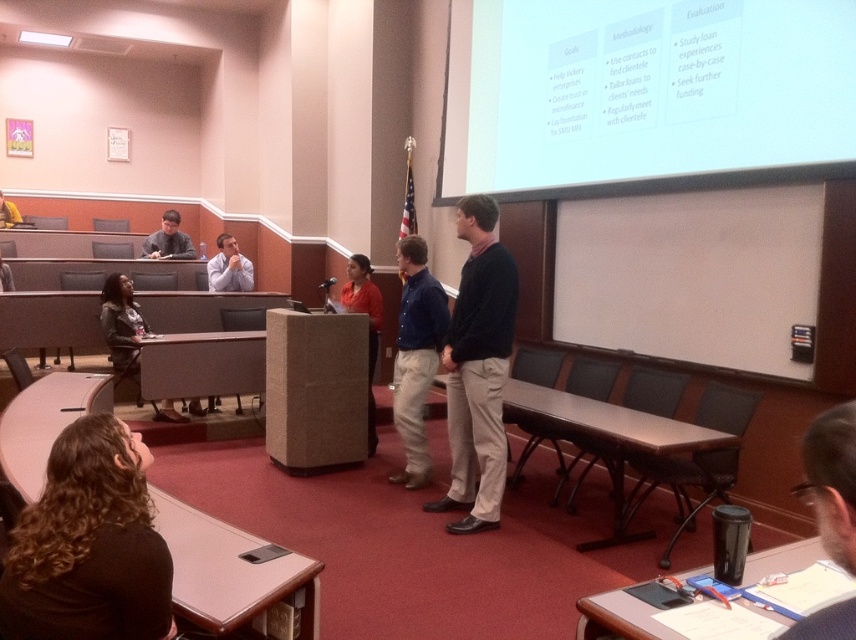
Question: Which of the following is the closest to the observer?

Choices:
 (A) (123, 339)
 (B) (819, 634)

Answer: (B)

Question: Can you confirm if white matte projection screen at upper center is positioned above blue denim shirt at center?

Choices:
 (A) yes
 (B) no

Answer: (A)

Question: Estimate the real-world distances between objects in this image. Which object is farther from the dark brown hair at lower right?

Choices:
 (A) leather jacket at left
 (B) matte gray sweater at left
 (C) dark blue sweater at center
 (D) dark brown curly hair at lower left

Answer: (B)

Question: In this image, where is dark blue sweater at center located relative to blue denim shirt at center?

Choices:
 (A) below
 (B) above

Answer: (B)

Question: Is dark blue sweater at center bigger than matte gray sweater at left?

Choices:
 (A) yes
 (B) no

Answer: (A)

Question: Which object is farther from the camera taking this photo?

Choices:
 (A) dark brown hair at lower right
 (B) leather jacket at left
 (C) dark brown curly hair at lower left

Answer: (B)